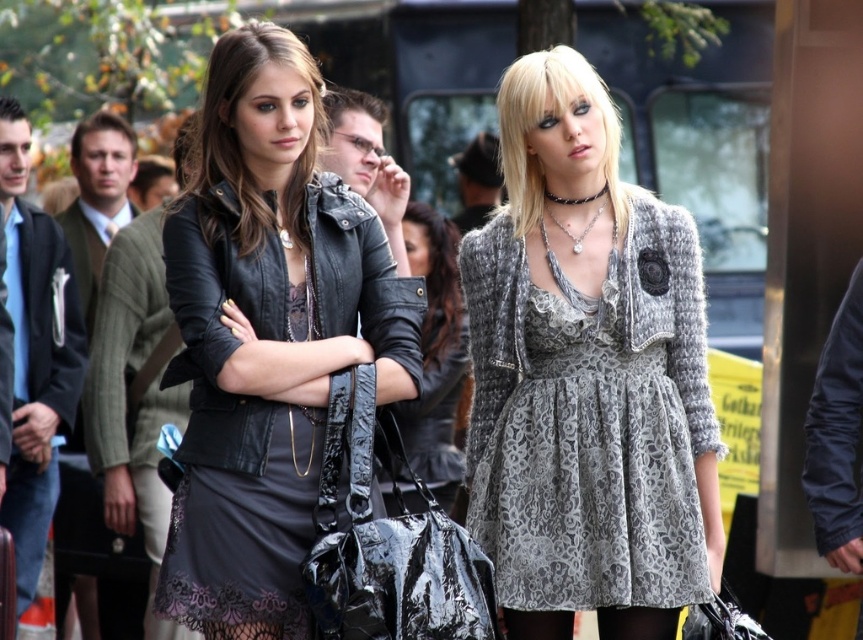
You are a photographer standing at the camera position. You want to take a photo of the black leather jacket at center. Is the jacket within your camera lens range? The camera can capture objects up to 30 feet away.

The black leather jacket at center is 34.94 feet away from the camera, which is beyond the camera lens range of 30 feet. Therefore, the jacket cannot be captured clearly.